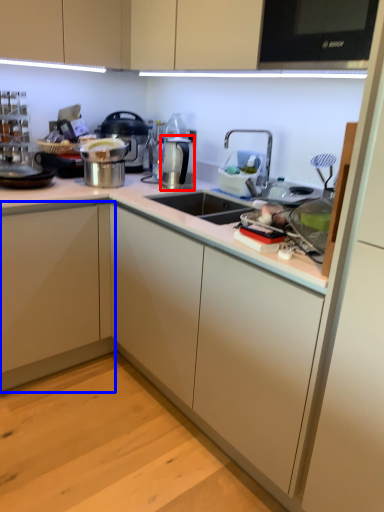
Question: Which object is further to the camera taking this photo, appliance (highlighted by a red box) or cabinetry (highlighted by a blue box)?

Choices:
 (A) appliance
 (B) cabinetry

Answer: (A)